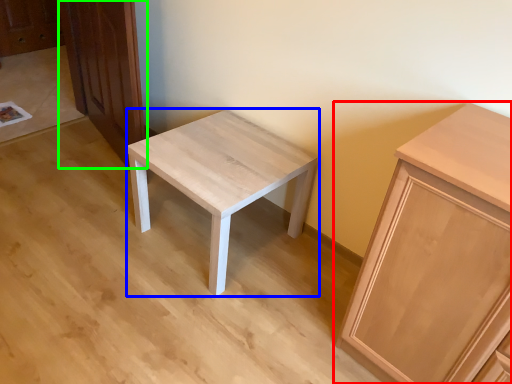
Question: Based on their relative distances, which object is farther from cabinetry (highlighted by a red box)? Choose from stool (highlighted by a blue box) and dresser (highlighted by a green box).

Choices:
 (A) stool
 (B) dresser

Answer: (B)